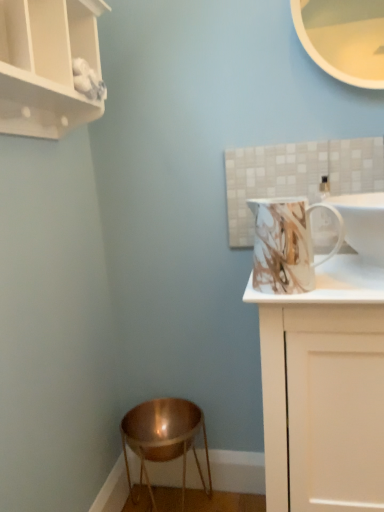
Question: Is white glossy sink at upper right inside or outside of copper metallic stool at lower left?

Choices:
 (A) inside
 (B) outside

Answer: (B)

Question: From their relative heights in the image, would you say white glossy sink at upper right is taller or shorter than copper metallic stool at lower left?

Choices:
 (A) short
 (B) tall

Answer: (A)

Question: Which of these objects is positioned closest to the copper metallic stool at lower left?

Choices:
 (A) marble-patterned ceramic mug at upper right
 (B) white glossy cabinet at right
 (C) white matte cupboard at upper left
 (D) white glossy sink at upper right

Answer: (B)

Question: Which is nearer to the white glossy cabinet at right?

Choices:
 (A) white glossy sink at upper right
 (B) copper metallic stool at lower left
 (C) white matte cupboard at upper left
 (D) marble-patterned ceramic mug at upper right

Answer: (D)